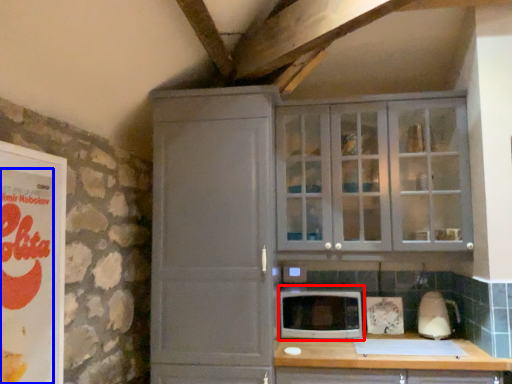
Question: Which object is closer to the camera taking this photo, microwave oven (highlighted by a red box) or advertisement (highlighted by a blue box)?

Choices:
 (A) microwave oven
 (B) advertisement

Answer: (B)